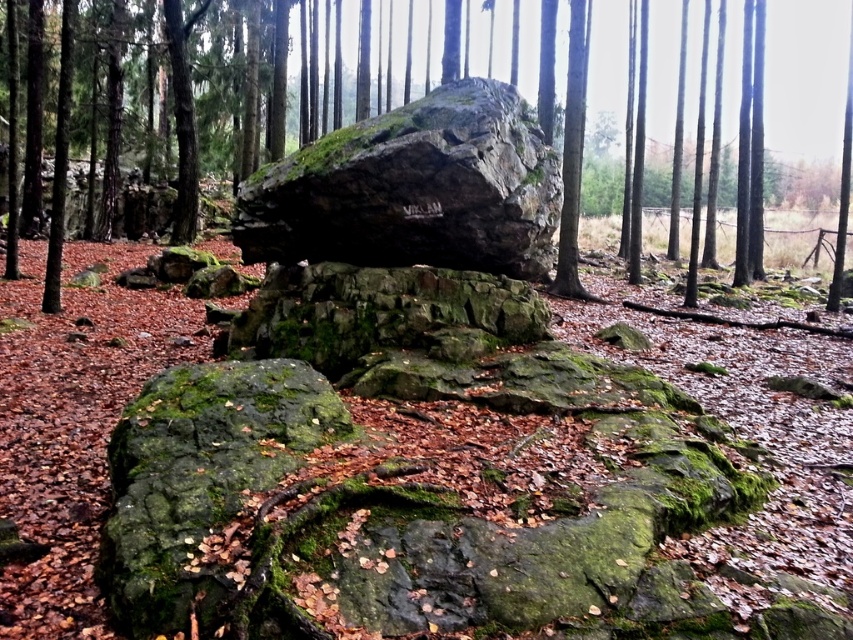
Is green mossy rock at center thinner than rough textured rock at center?

In fact, green mossy rock at center might be wider than rough textured rock at center.

Does point (540, 115) lie behind point (491, 214)?

Yes, point (540, 115) is farther from viewer.

Find the location of a particular element. The height and width of the screenshot is (640, 853). green mossy rock at center is located at coordinates (460, 93).